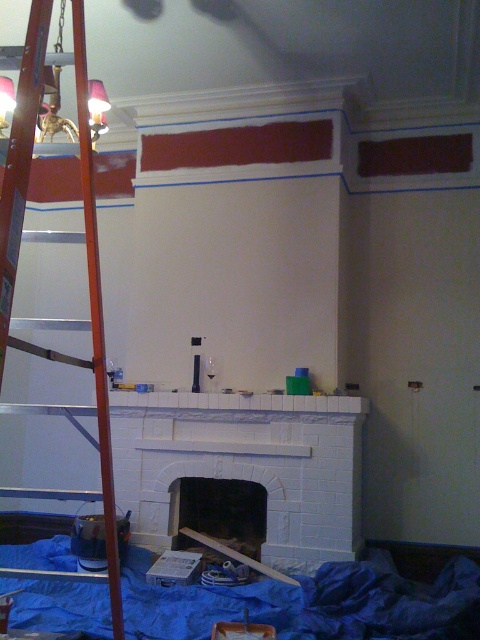
You are standing in the room and want to place a tall decoration on the tallest object in the scene. Which object should you choose between the white brick fireplace at center and the wooden at left?

The wooden at left is taller than the white brick fireplace at center, so you should place the tall decoration on the wooden at left.

You are a painter who needs to reach the ceiling above the white brick fireplace at center. You have a ladder that is 6 feet tall. The wooden at left is a ladder. Can you safely reach the ceiling using the ladder?

The white brick fireplace at center and wooden at left are 6.55 feet apart. Since the ladder is 6 feet tall, it is shorter than the distance between the fireplace and the ladder. Therefore, you cannot safely reach the ceiling using the ladder.